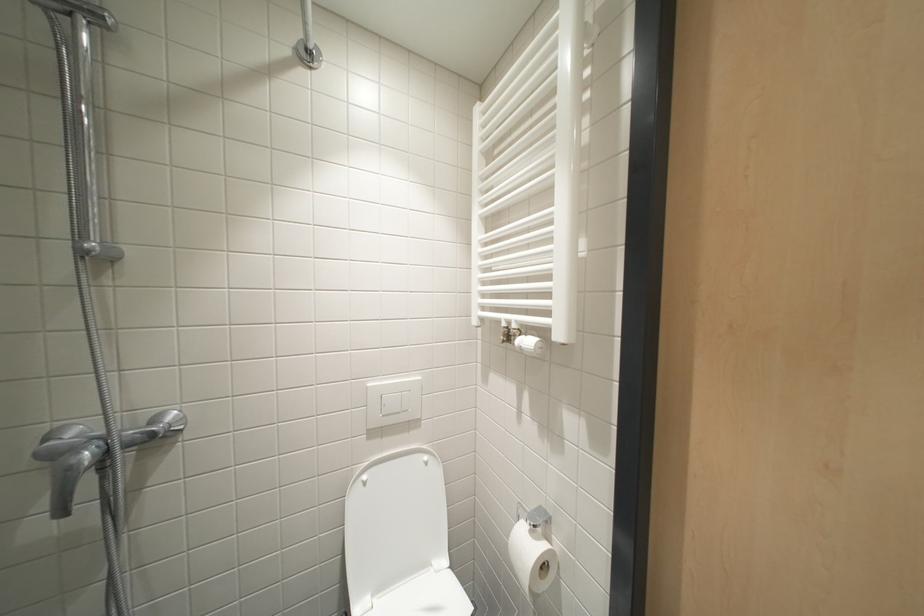
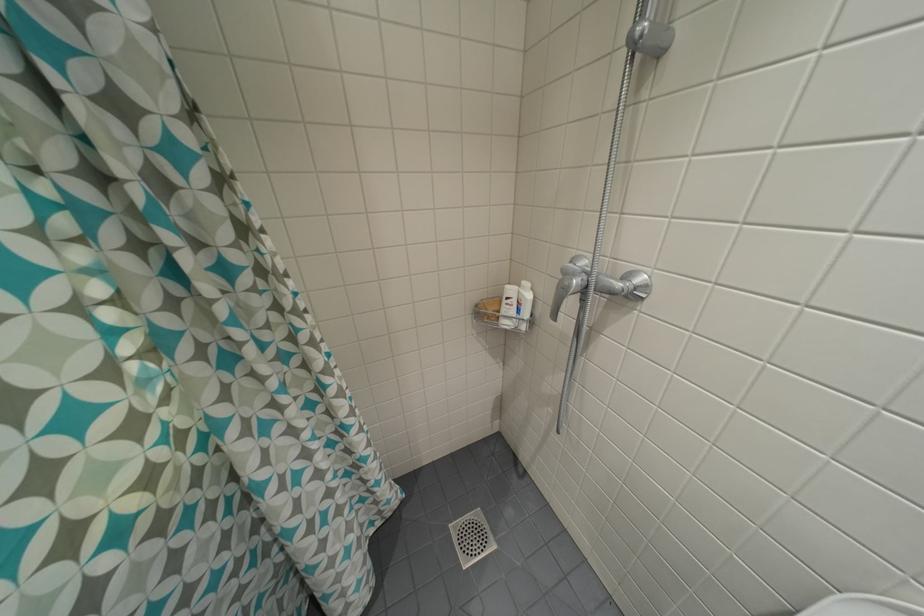
The images are taken continuously from a first-person perspective. In which direction is your viewpoint rotating?

The rotation direction of the camera is left-down.